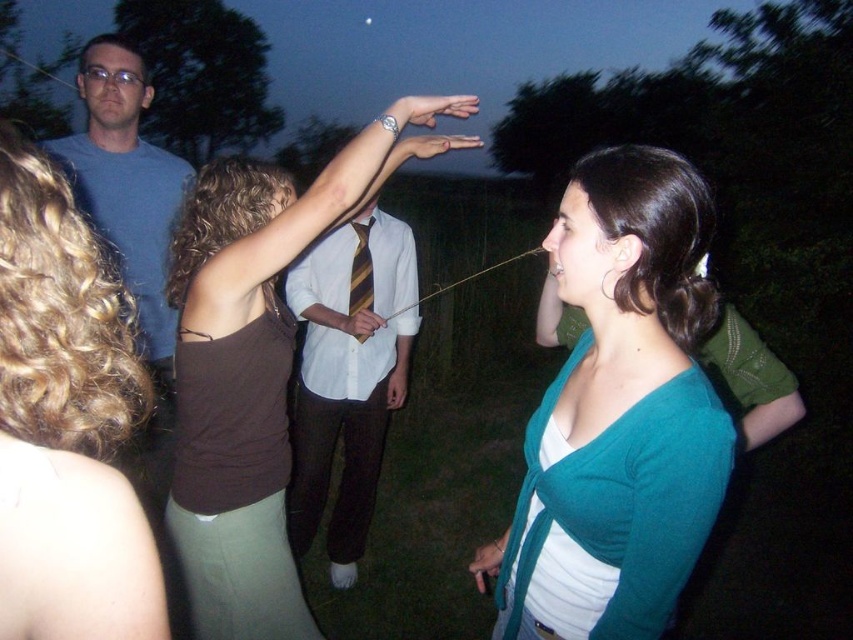
Does point (694, 301) come behind point (51, 252)?

Yes.

Locate an element on the screen. teal knit cardigan at center is located at coordinates (625, 397).

Does point (689, 225) lie in front of point (12, 394)?

No.

Where is `teal knit cardigan at center`? The image size is (853, 640). teal knit cardigan at center is located at coordinates coord(625,397).

Does point (270, 243) lie in front of point (352, 445)?

Yes, it is in front of point (352, 445).

Image resolution: width=853 pixels, height=640 pixels. What do you see at coordinates (256, 365) in the screenshot?
I see `brown fabric shirt at center` at bounding box center [256, 365].

Where is `brown fabric shirt at center`? brown fabric shirt at center is located at coordinates (256, 365).

Looking at this image, who is more forward, (285,214) or (22,627)?

Point (22,627)

Which is more to the right, brown fabric shirt at center or brown fabric dress at upper left?

brown fabric shirt at center

The image size is (853, 640). What do you see at coordinates (256, 365) in the screenshot?
I see `brown fabric shirt at center` at bounding box center [256, 365].

Where is `brown fabric shirt at center`? The height and width of the screenshot is (640, 853). brown fabric shirt at center is located at coordinates pyautogui.click(x=256, y=365).